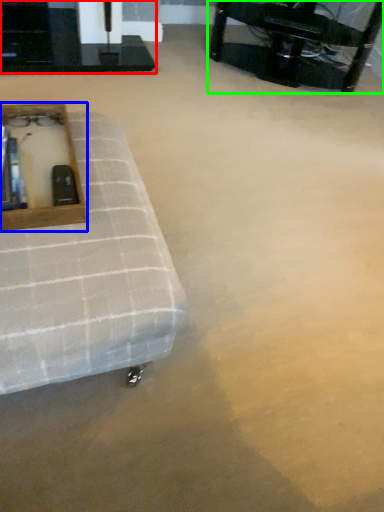
Question: Which is farther away from table (highlighted by a red box)? vanity (highlighted by a blue box) or table (highlighted by a green box)?

Choices:
 (A) vanity
 (B) table

Answer: (A)